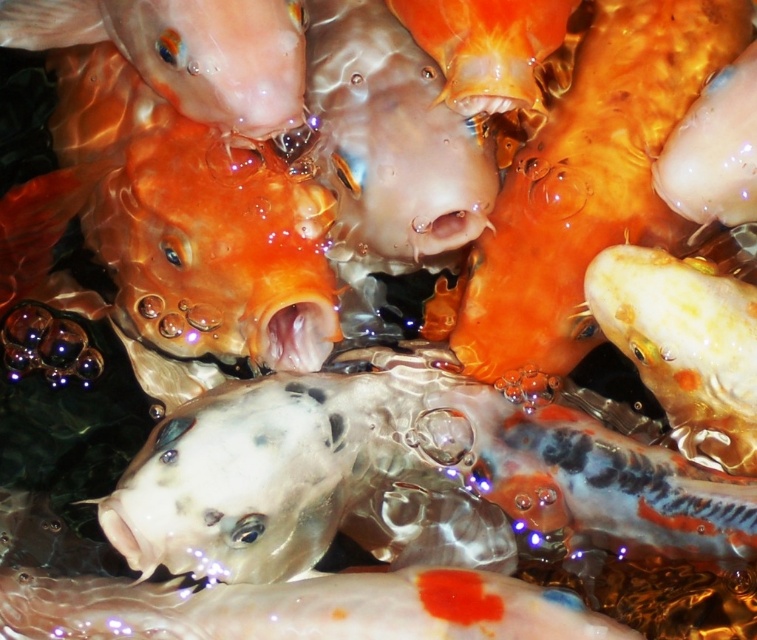
Does matte orange fish at upper left have a lesser height compared to orange glossy goldfish at upper center?

In fact, matte orange fish at upper left may be taller than orange glossy goldfish at upper center.

Locate an element on the screen. matte orange fish at upper left is located at coordinates (185, 51).

Between point (251, 120) and point (419, 38), which one is positioned behind?

Point (419, 38)

You are a GUI agent. You are given a task and a screenshot of the screen. Output one action in this format:
    pyautogui.click(x=<x>, y=<y>)
    Task: Click on the matte orange fish at upper left
    
    Given the screenshot: What is the action you would take?
    pyautogui.click(x=185, y=51)

Is shiny white fish at bottom positioned before shiny white fish at center?

That is True.

Is shiny white fish at bottom above shiny white fish at center?

Incorrect, shiny white fish at bottom is not positioned above shiny white fish at center.

What are the coordinates of `shiny white fish at bottom` in the screenshot? It's located at (301, 609).

Is point (188, 484) less distant than point (413, 132)?

Yes, it is in front of point (413, 132).

Is translucent white fish at center shorter than translucent orange fish at center?

Yes.

Where is `translucent white fish at center`? This screenshot has height=640, width=757. translucent white fish at center is located at coordinates (310, 476).